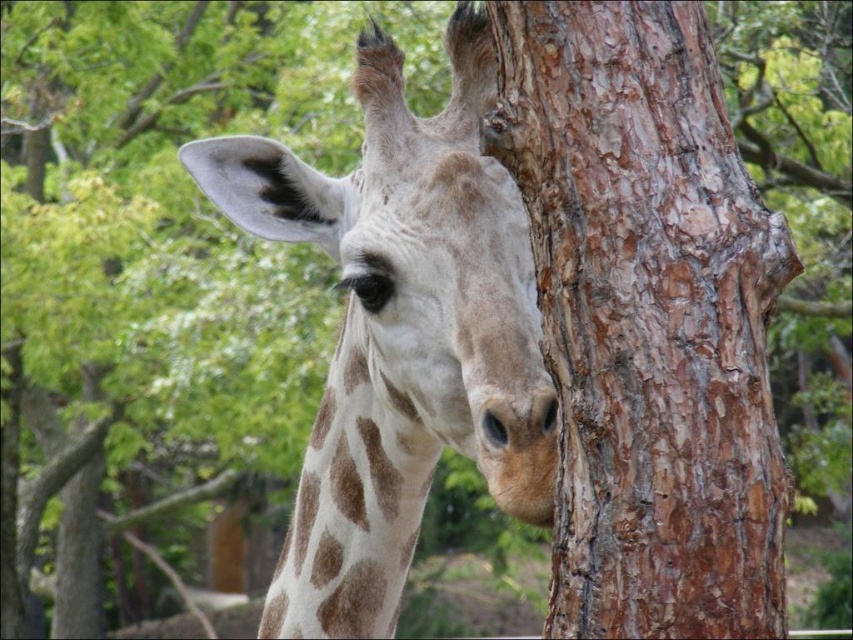
Question: Can you confirm if brown rough bark at center is positioned to the right of spotted fur at center?

Choices:
 (A) yes
 (B) no

Answer: (A)

Question: Does brown rough bark at center have a smaller size compared to spotted fur at center?

Choices:
 (A) no
 (B) yes

Answer: (B)

Question: Is brown rough bark at center smaller than spotted fur at center?

Choices:
 (A) no
 (B) yes

Answer: (B)